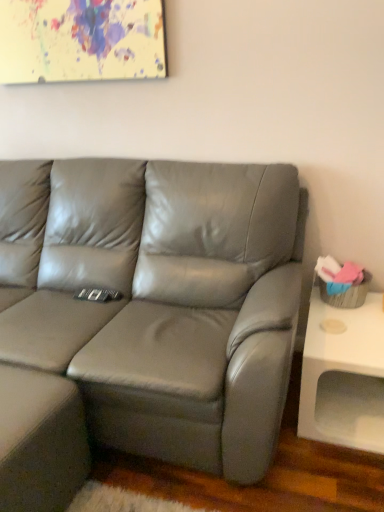
Find the location of a particular element. The image size is (384, 512). vacant area on top of white matte table at right (from a real-world perspective) is located at coordinates pos(363,323).